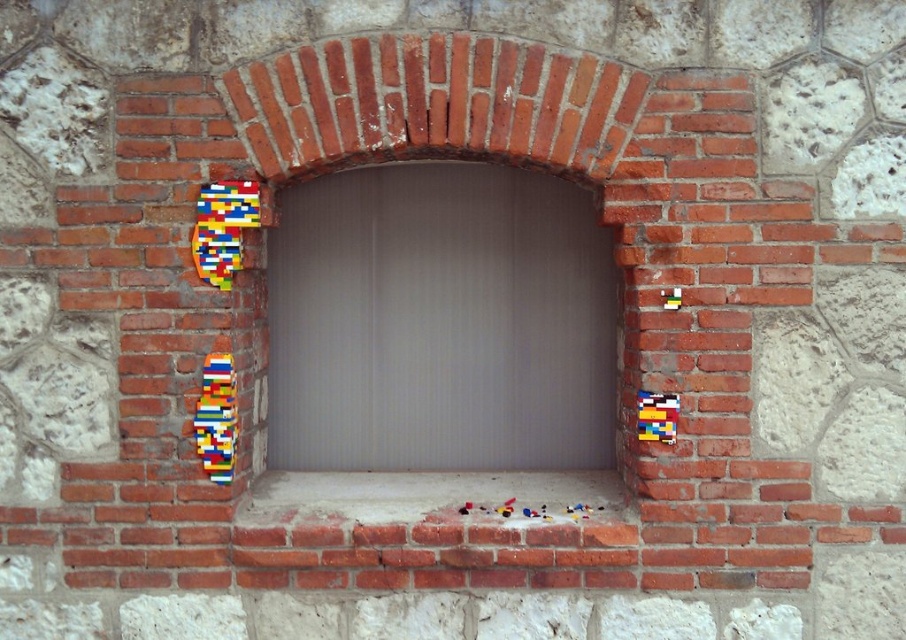
Between brick at center and white concrete at center, which one has more height?

With more height is brick at center.

Where is `brick at center`? This screenshot has width=906, height=640. brick at center is located at coordinates (439, 342).

Where is `brick at center`? brick at center is located at coordinates (439, 342).